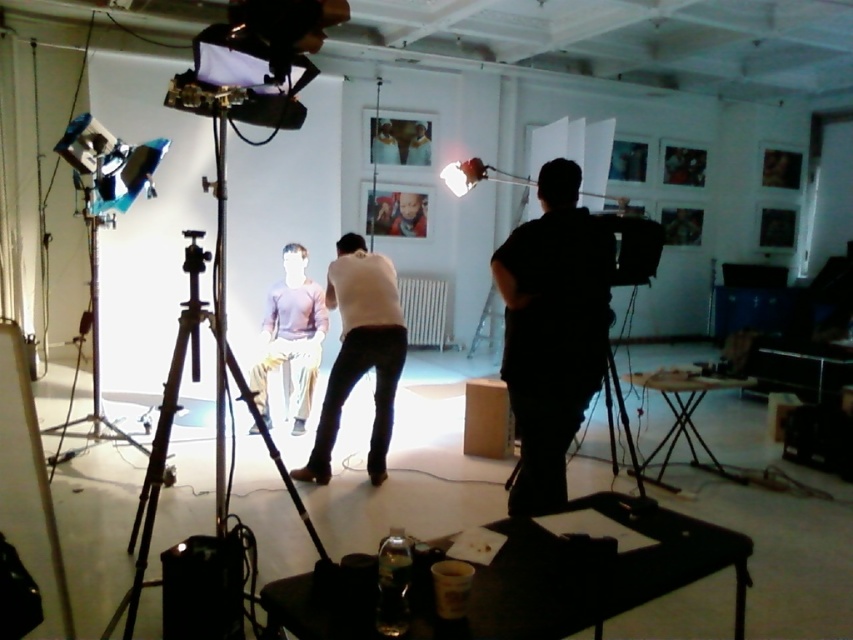
Question: Does black matte tripod at left lie behind black matte tripod at lower right?

Choices:
 (A) no
 (B) yes

Answer: (B)

Question: Does white matte shirt at center have a lesser width compared to black matte tripod at center?

Choices:
 (A) no
 (B) yes

Answer: (B)

Question: Which point appears farthest from the camera in this image?

Choices:
 (A) (408, 220)
 (B) (85, 205)
 (C) (614, 388)

Answer: (A)

Question: Which object appears closest to the camera in this image?

Choices:
 (A) black matte shirt at right
 (B) black matte tripod at left
 (C) smooth skin man at upper center
 (D) matte purple shirt at center

Answer: (A)

Question: Can you confirm if matte purple shirt at center is positioned to the right of smooth skin man at upper center?

Choices:
 (A) no
 (B) yes

Answer: (A)

Question: Which of the following is the closest to the observer?

Choices:
 (A) (259, 355)
 (B) (213, 326)
 (C) (587, 220)
 (D) (408, 212)

Answer: (B)